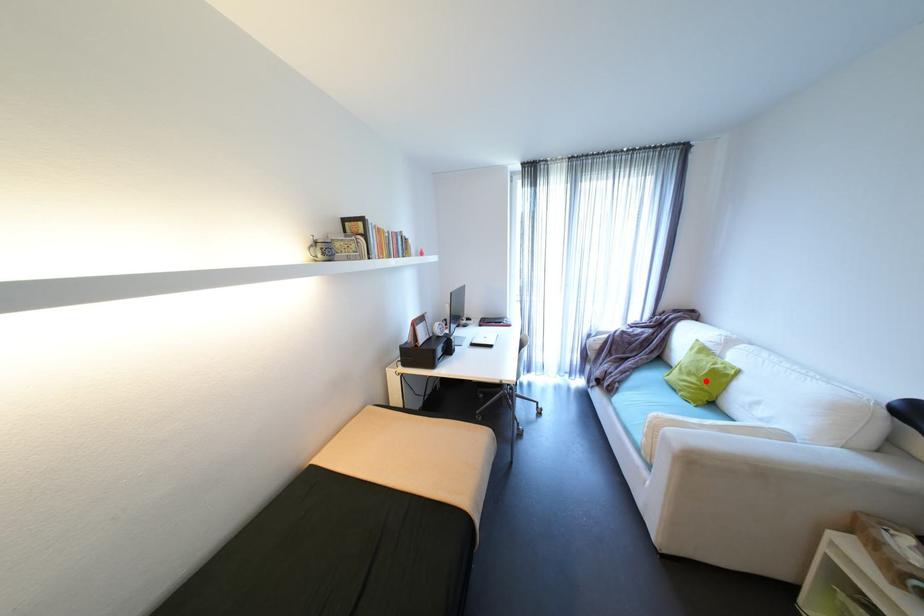
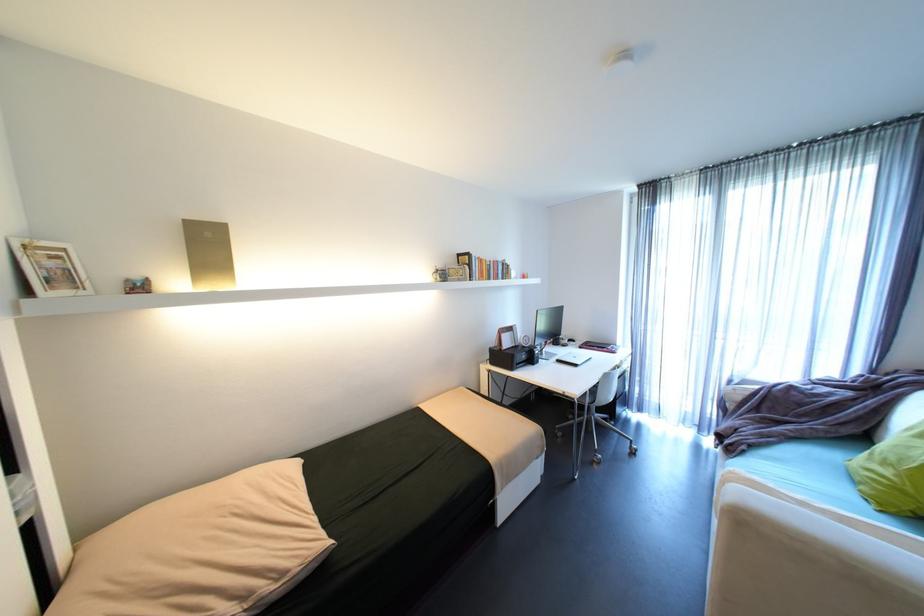
The point at the highlighted location is marked in the first image. Where is the corresponding point in the second image?

(906, 476)